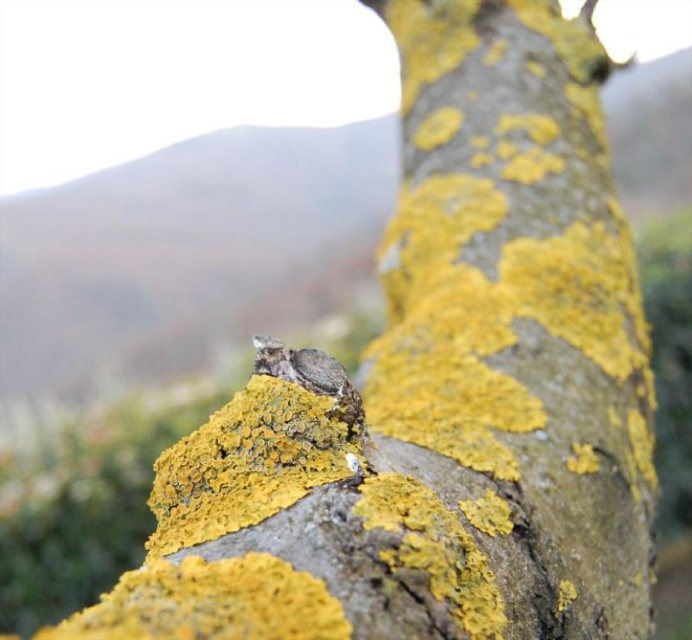
Question: Which point is closer to the camera?

Choices:
 (A) (421, 198)
 (B) (260, 339)

Answer: (B)

Question: Does yellow lichen-covered bark at center have a smaller size compared to brown fuzzy bird at upper center?

Choices:
 (A) no
 (B) yes

Answer: (A)

Question: Among these points, which one is nearest to the camera?

Choices:
 (A) tap(590, 522)
 (B) tap(262, 369)

Answer: (B)

Question: Is yellow lichen-covered bark at center below brown fuzzy bird at upper center?

Choices:
 (A) no
 (B) yes

Answer: (A)

Question: Where is yellow lichen-covered bark at center located in relation to brown fuzzy bird at upper center in the image?

Choices:
 (A) above
 (B) below

Answer: (A)